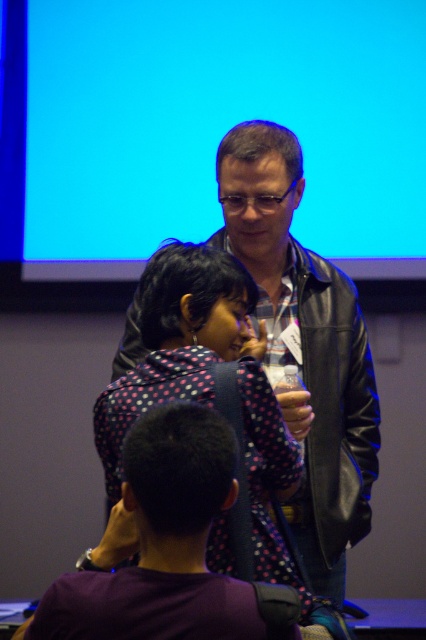
Who is taller, leather jacket at center or purple dotted shirt at lower center?

Standing taller between the two is leather jacket at center.

Does leather jacket at center have a smaller size compared to purple dotted shirt at lower center?

Actually, leather jacket at center might be larger than purple dotted shirt at lower center.

Which is behind, point (281, 198) or point (146, 540)?

Positioned behind is point (281, 198).

Find the location of `leather jacket at center`. leather jacket at center is located at coordinates (305, 346).

Which is in front, point (245, 266) or point (207, 256)?

Point (207, 256) is more forward.

Who is shorter, leather jacket at center or polka dot fabric at center?

Standing shorter between the two is polka dot fabric at center.

Is point (270, 276) positioned behind point (227, 314)?

Yes, point (270, 276) is farther from viewer.

The image size is (426, 640). In order to click on leather jacket at center in this screenshot , I will do `click(305, 346)`.

What do you see at coordinates (219, 125) in the screenshot? I see `blue matte projection screen at upper center` at bounding box center [219, 125].

Which is below, blue matte projection screen at upper center or polka dot fabric at center?

Positioned lower is polka dot fabric at center.

In order to click on blue matte projection screen at upper center in this screenshot , I will do (x=219, y=125).

The image size is (426, 640). Find the location of `blue matte projection screen at upper center`. blue matte projection screen at upper center is located at coordinates (219, 125).